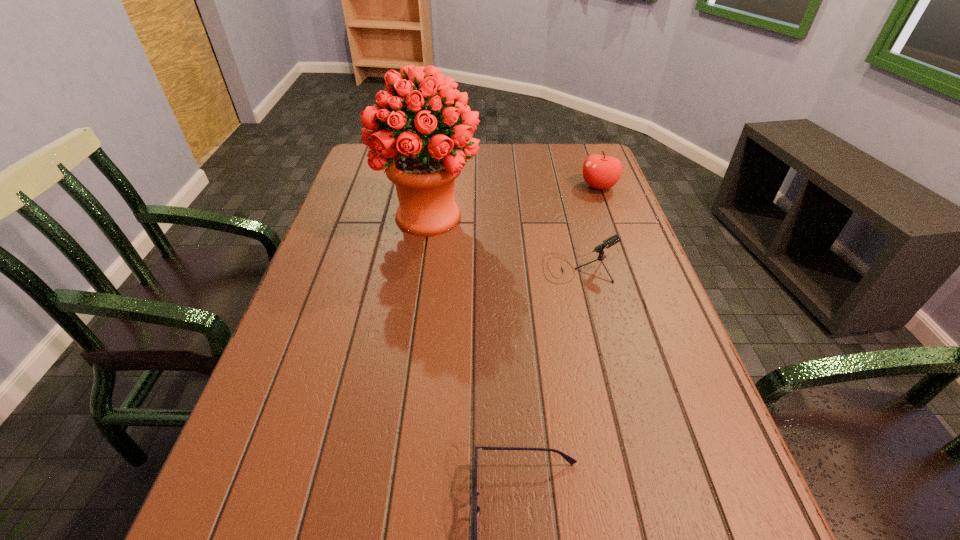
You are a GUI agent. You are given a task and a screenshot of the screen. Output one action in this format:
    pyautogui.click(x=<x>, y=<y>)
    Task: Click on the apple present at the right edge
    The height and width of the screenshot is (540, 960).
    Given the screenshot: What is the action you would take?
    pyautogui.click(x=602, y=172)

I want to click on microphone that is at the right edge, so click(616, 238).

You are a GUI agent. You are given a task and a screenshot of the screen. Output one action in this format:
    pyautogui.click(x=<x>, y=<y>)
    Task: Click on the object located at the far right corner
    
    Given the screenshot: What is the action you would take?
    pyautogui.click(x=602, y=172)

Where is `free space at the far edge of the desktop`? This screenshot has height=540, width=960. free space at the far edge of the desktop is located at coordinates (537, 165).

Identify the location of blank space at the left edge. (333, 268).

The image size is (960, 540). What are the coordinates of `vacant space at the right edge` in the screenshot? It's located at (661, 506).

Find the location of a particular element. The height and width of the screenshot is (540, 960). vacant space at the far right corner of the desktop is located at coordinates (570, 158).

I want to click on vacant area that lies between the bouquet and the apple, so click(514, 201).

Locate an element on the screen. The width and height of the screenshot is (960, 540). unoccupied area between the apple and the bouquet is located at coordinates (514, 201).

Where is `vacant area that lies between the apple and the microphone`? The width and height of the screenshot is (960, 540). vacant area that lies between the apple and the microphone is located at coordinates pyautogui.click(x=588, y=227).